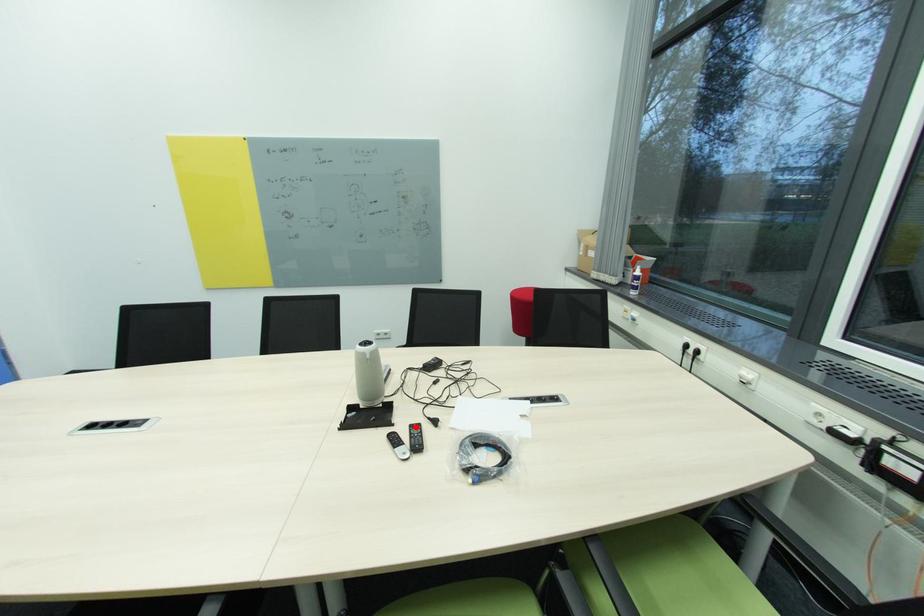
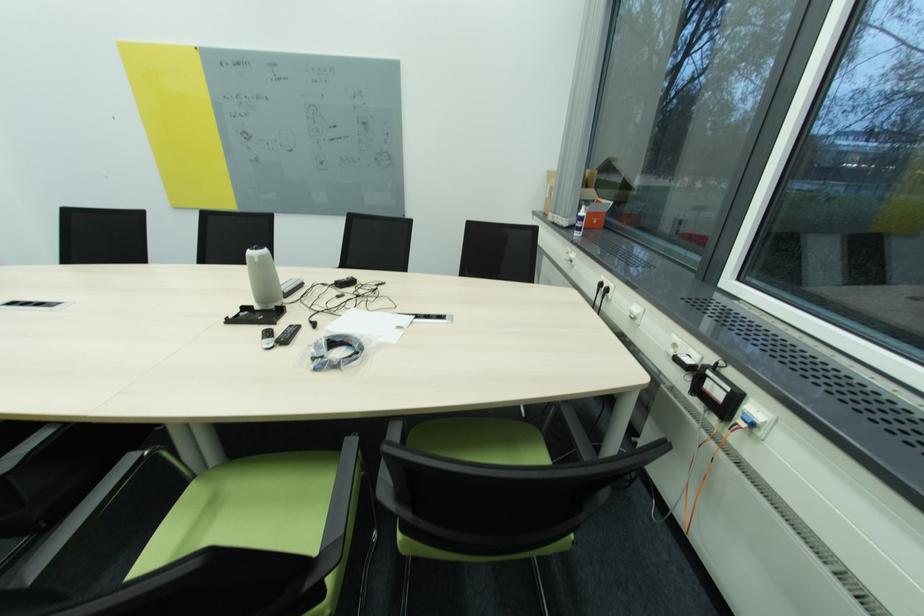
In the second image, find the point that corresponds to the highlighted location in the first image.

(296, 328)